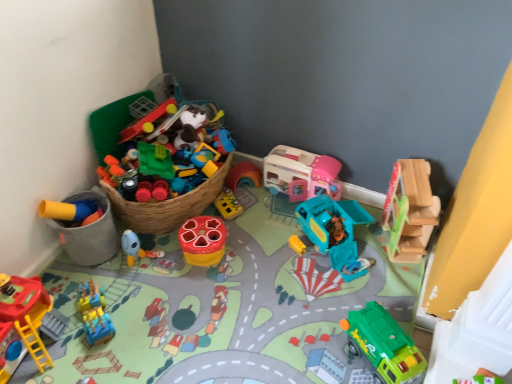
Locate an element on the screen. vacant space that is in between rubberized plastic toy at center, positioned as the fourth toy in left-to-right order, and blue rubber duck at center, which is the 3th toy in left-to-right order is located at coordinates (170, 256).